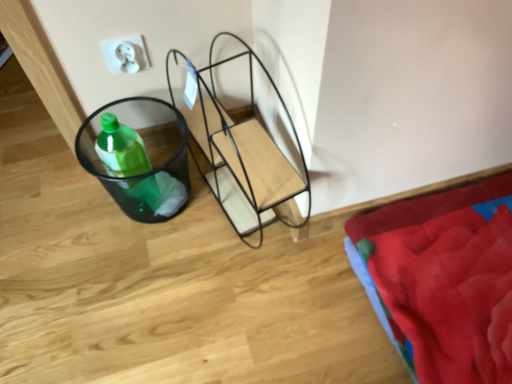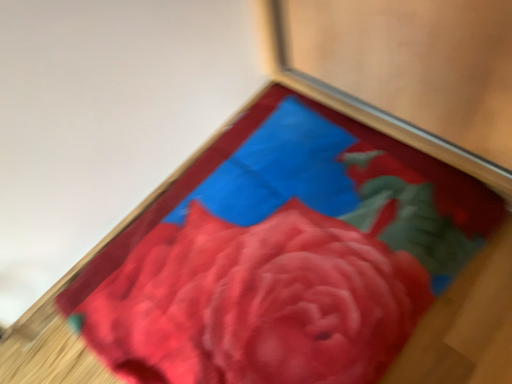
Question: How did the camera likely rotate when shooting the video?

Choices:
 (A) rotated right
 (B) rotated left

Answer: (A)